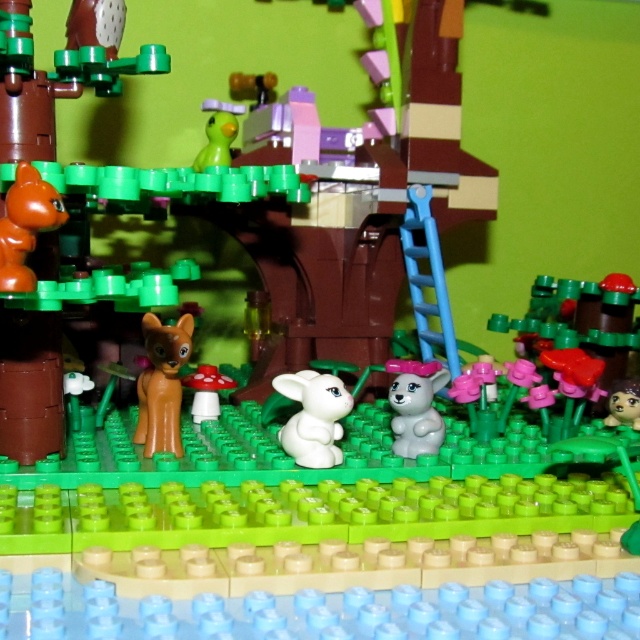
Can you confirm if white glossy rabbit at center is shorter than orange matte cat at left?

Yes, white glossy rabbit at center is shorter than orange matte cat at left.

Is white glossy rabbit at center below orange matte cat at left?

Yes.

Locate an element on the screen. Image resolution: width=640 pixels, height=640 pixels. white glossy rabbit at center is located at coordinates (314, 417).

Identify the location of white glossy rabbit at center. This screenshot has width=640, height=640. (314, 417).

Can you confirm if orange matte cat at left is smaller than white matte rabbit at center?

Correct, orange matte cat at left occupies less space than white matte rabbit at center.

Locate an element on the screen. The height and width of the screenshot is (640, 640). orange matte cat at left is located at coordinates (26, 227).

Is point (19, 253) positioned in front of point (632, 385)?

Yes, it is.

Who is higher up, orange matte cat at left or brown matte rabbit at center?

orange matte cat at left

In order to click on orange matte cat at left in this screenshot , I will do `click(26, 227)`.